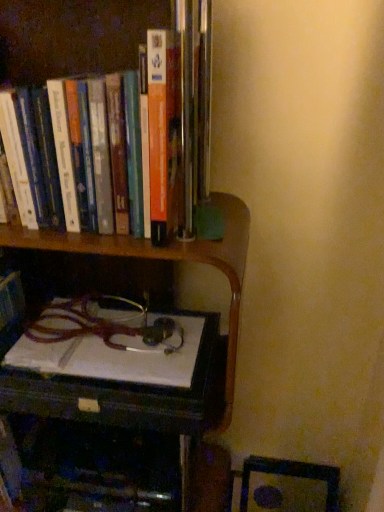
Question: Should I look upward or downward to see wooden desk at lower center?

Choices:
 (A) down
 (B) up

Answer: (A)

Question: Is wooden desk at lower center aimed at wooden table at lower left?

Choices:
 (A) no
 (B) yes

Answer: (A)

Question: Can you confirm if wooden desk at lower center is smaller than wooden table at lower left?

Choices:
 (A) no
 (B) yes

Answer: (B)

Question: From the image's perspective, is wooden desk at lower center under wooden table at lower left?

Choices:
 (A) no
 (B) yes

Answer: (A)

Question: From a real-world perspective, is wooden desk at lower center physically above wooden table at lower left?

Choices:
 (A) no
 (B) yes

Answer: (B)

Question: Does wooden desk at lower center have a greater width compared to wooden table at lower left?

Choices:
 (A) no
 (B) yes

Answer: (A)

Question: Can you confirm if wooden desk at lower center is shorter than wooden table at lower left?

Choices:
 (A) no
 (B) yes

Answer: (B)

Question: Is hardcover books at upper left oriented towards wooden bookcase at upper left?

Choices:
 (A) yes
 (B) no

Answer: (A)

Question: Is hardcover books at upper left not close to wooden bookcase at upper left?

Choices:
 (A) no
 (B) yes

Answer: (A)

Question: Can you confirm if hardcover books at upper left is positioned to the right of wooden bookcase at upper left?

Choices:
 (A) no
 (B) yes

Answer: (B)

Question: Is hardcover books at upper left beside wooden bookcase at upper left?

Choices:
 (A) no
 (B) yes

Answer: (A)

Question: Considering the relative sizes of hardcover books at upper left and wooden bookcase at upper left in the image provided, is hardcover books at upper left smaller than wooden bookcase at upper left?

Choices:
 (A) yes
 (B) no

Answer: (A)

Question: Is hardcover books at upper left positioned beyond the bounds of wooden bookcase at upper left?

Choices:
 (A) no
 (B) yes

Answer: (A)

Question: Is the surface of wooden desk at lower center in direct contact with hardcover books at upper left?

Choices:
 (A) no
 (B) yes

Answer: (A)